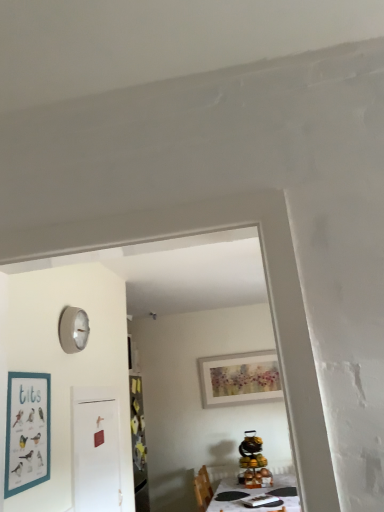
Where is `vacant point above white matte door at center (from a real-world perspective)`? The width and height of the screenshot is (384, 512). vacant point above white matte door at center (from a real-world perspective) is located at coordinates (102, 386).